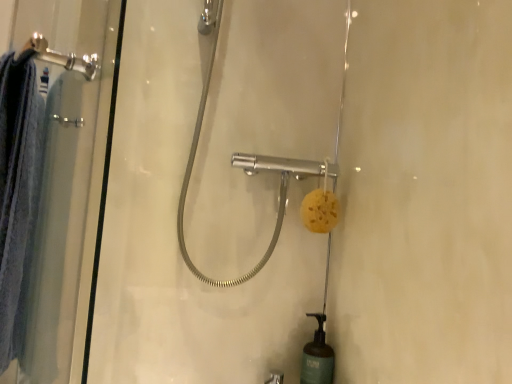
At what (x,y) coordinates should I click in order to perform the action: click on yellow sponge at center. Please return your answer as a coordinate pair (x, y). Looking at the image, I should click on (247, 174).

The width and height of the screenshot is (512, 384). What do you see at coordinates (247, 174) in the screenshot? I see `yellow sponge at center` at bounding box center [247, 174].

Find the location of `clear glass shower door at left`. clear glass shower door at left is located at coordinates (66, 184).

This screenshot has height=384, width=512. Describe the element at coordinates (66, 184) in the screenshot. I see `clear glass shower door at left` at that location.

Locate an element on the screen. The image size is (512, 384). yellow sponge at center is located at coordinates (247, 174).

Which object is positioned more to the right, clear glass shower door at left or yellow sponge at center?

yellow sponge at center.

Is the depth of clear glass shower door at left less than that of yellow sponge at center?

Yes.

Which is more distant, [46,242] or [286,163]?

Point [286,163]

From the image's perspective, is clear glass shower door at left above yellow sponge at center?

No.

From a real-world perspective, which is physically above, clear glass shower door at left or yellow sponge at center?

In real-world perspective, yellow sponge at center is above.

Considering the sizes of objects clear glass shower door at left and yellow sponge at center in the image provided, who is thinner, clear glass shower door at left or yellow sponge at center?

clear glass shower door at left.

Between clear glass shower door at left and yellow sponge at center, which one has less height?

yellow sponge at center.

Does clear glass shower door at left have a larger size compared to yellow sponge at center?

Indeed, clear glass shower door at left has a larger size compared to yellow sponge at center.

Is clear glass shower door at left positioned beyond the bounds of yellow sponge at center?

Indeed, clear glass shower door at left is completely outside yellow sponge at center.

Is clear glass shower door at left next to yellow sponge at center and touching it?

No, clear glass shower door at left is not making contact with yellow sponge at center.

Is clear glass shower door at left aimed at yellow sponge at center?

No, clear glass shower door at left is not turned towards yellow sponge at center.

Locate an element on the screen. shower door below the yellow sponge at center (from a real-world perspective) is located at coordinates (66, 184).

Considering the positions of objects yellow sponge at center and clear glass shower door at left in the image provided, who is more to the right, yellow sponge at center or clear glass shower door at left?

From the viewer's perspective, yellow sponge at center appears more on the right side.

Is yellow sponge at center in front of or behind clear glass shower door at left in the image?

Clearly, yellow sponge at center is behind clear glass shower door at left.

Considering the positions of point (252, 168) and point (42, 301), is point (252, 168) closer or farther from the camera than point (42, 301)?

Clearly, point (252, 168) is more distant from the camera than point (42, 301).

From the image's perspective, is yellow sponge at center located above clear glass shower door at left?

Yes, from the image's perspective, yellow sponge at center is on top of clear glass shower door at left.

Based on the photo, from a real-world perspective, is yellow sponge at center under clear glass shower door at left?

No, from a real-world perspective, yellow sponge at center is not under clear glass shower door at left.

Considering the sizes of objects yellow sponge at center and clear glass shower door at left in the image provided, who is thinner, yellow sponge at center or clear glass shower door at left?

clear glass shower door at left.

In terms of height, does yellow sponge at center look taller or shorter compared to clear glass shower door at left?

Considering their sizes, yellow sponge at center has less height than clear glass shower door at left.

Between yellow sponge at center and clear glass shower door at left, which one has larger size?

With larger size is clear glass shower door at left.

Would you say yellow sponge at center is outside clear glass shower door at left?

Yes, yellow sponge at center is not within clear glass shower door at left.

Is yellow sponge at center not close to clear glass shower door at left?

yellow sponge at center is actually quite close to clear glass shower door at left.

Is yellow sponge at center facing away from clear glass shower door at left?

No, clear glass shower door at left is not at the back of yellow sponge at center.

What's the angular difference between yellow sponge at center and clear glass shower door at left's facing directions?

87.4 degrees separate the facing orientations of yellow sponge at center and clear glass shower door at left.

How much distance is there between yellow sponge at center and clear glass shower door at left?

A distance of 15.71 inches exists between yellow sponge at center and clear glass shower door at left.

Where is `shower located above the clear glass shower door at left (from a real-world perspective)`? This screenshot has height=384, width=512. shower located above the clear glass shower door at left (from a real-world perspective) is located at coordinates [247, 174].

You are a GUI agent. You are given a task and a screenshot of the screen. Output one action in this format:
    pyautogui.click(x=<x>, y=<y>)
    Task: Click on the shower located above the clear glass shower door at left (from the image's perspective)
    The height and width of the screenshot is (384, 512).
    Given the screenshot: What is the action you would take?
    pyautogui.click(x=247, y=174)

At what (x,y) coordinates should I click in order to perform the action: click on shower door that is in front of the yellow sponge at center. Please return your answer as a coordinate pair (x, y). The image size is (512, 384). Looking at the image, I should click on (66, 184).